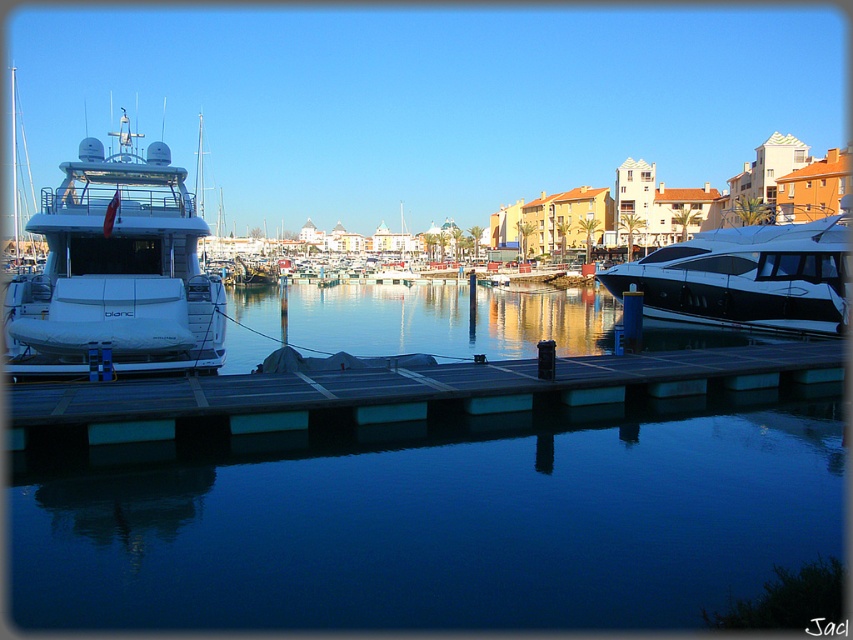
You are standing on the dock and want to take a photo of the clear glass water at center. Where should you position yourself to capture it in the center of your camera viewfinder?

Position yourself directly above the clear glass water at center since its 2D location is at the center coordinates of the image, which is point (416, 321).

You are a photographer planning to capture a photo of the transparent glass water at center and the white glossy yacht at right. Based on their relative heights, which object should you focus on first to ensure proper framing?

The transparent glass water at center is not as tall as the white glossy yacht at right, so you should focus on the white glossy yacht at right first since it is taller and will occupy more of the frame.